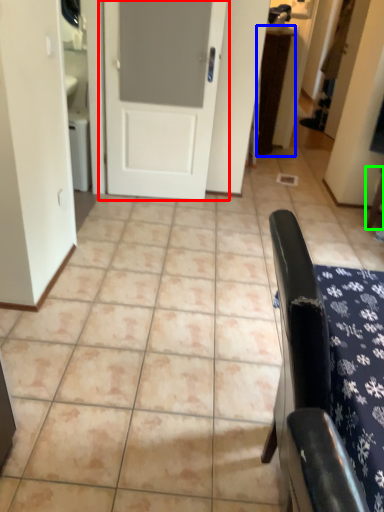
Question: Based on their relative distances, which object is farther from door (highlighted by a red box)? Choose from table (highlighted by a blue box) and furniture (highlighted by a green box).

Choices:
 (A) table
 (B) furniture

Answer: (B)